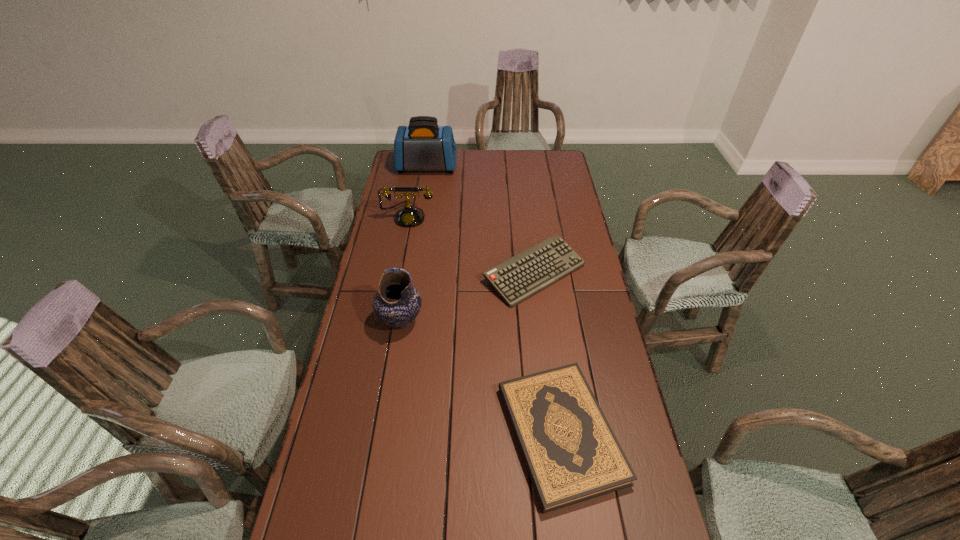
You are a GUI agent. You are given a task and a screenshot of the screen. Output one action in this format:
    pyautogui.click(x=<x>, y=<y>)
    Task: Click on the blank space that satisfies the following two spatial constraints: 1. on the front-facing side of the fourth tallest object; 2. on the right side of the farthest object
    This screenshot has height=540, width=960.
    Given the screenshot: What is the action you would take?
    pyautogui.click(x=410, y=273)

The height and width of the screenshot is (540, 960). I want to click on free space in the image that satisfies the following two spatial constraints: 1. on the front-facing side of the computer keyboard; 2. on the left side of the farthest object, so click(410, 273).

Locate an element on the screen. The width and height of the screenshot is (960, 540). vacant region that satisfies the following two spatial constraints: 1. on the front-facing side of the second shortest object; 2. on the right side of the toaster is located at coordinates (410, 273).

Where is `blank area in the image that satisfies the following two spatial constraints: 1. on the front-facing side of the tallest object; 2. on the back side of the fourth tallest object`? This screenshot has height=540, width=960. blank area in the image that satisfies the following two spatial constraints: 1. on the front-facing side of the tallest object; 2. on the back side of the fourth tallest object is located at coordinates (410, 273).

Where is `free space that satisfies the following two spatial constraints: 1. on the back side of the pottery; 2. on the right side of the fourth tallest object`? This screenshot has width=960, height=540. free space that satisfies the following two spatial constraints: 1. on the back side of the pottery; 2. on the right side of the fourth tallest object is located at coordinates (408, 273).

Where is `free spot that satisfies the following two spatial constraints: 1. on the back side of the fourth tallest object; 2. on the front-facing side of the farthest object`? free spot that satisfies the following two spatial constraints: 1. on the back side of the fourth tallest object; 2. on the front-facing side of the farthest object is located at coordinates (521, 167).